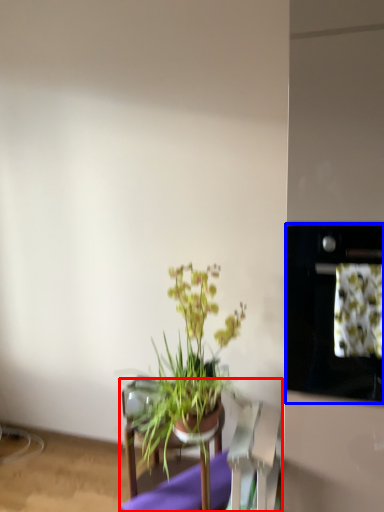
Question: Among these objects, which one is farthest to the camera, furniture (highlighted by a red box) or oven (highlighted by a blue box)?

Choices:
 (A) furniture
 (B) oven

Answer: (A)